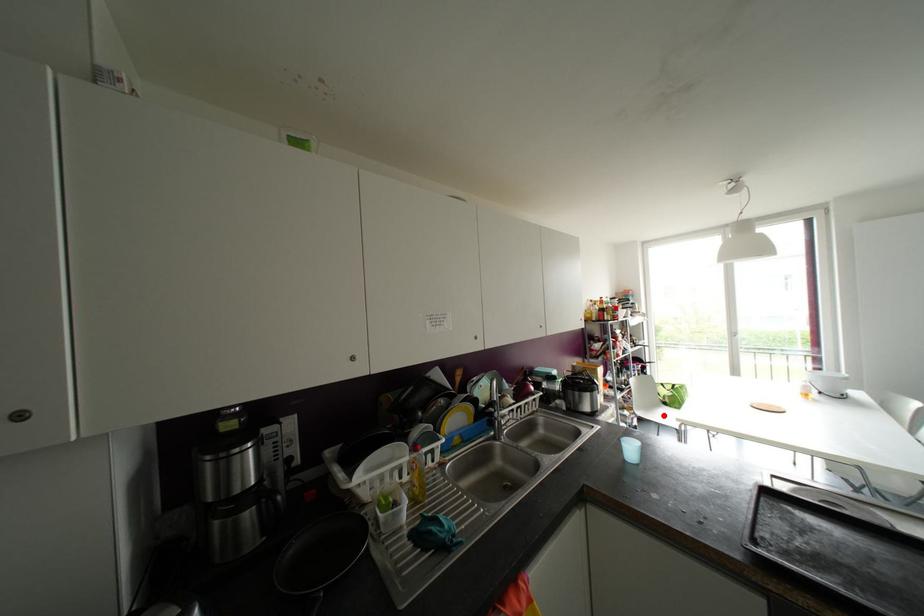
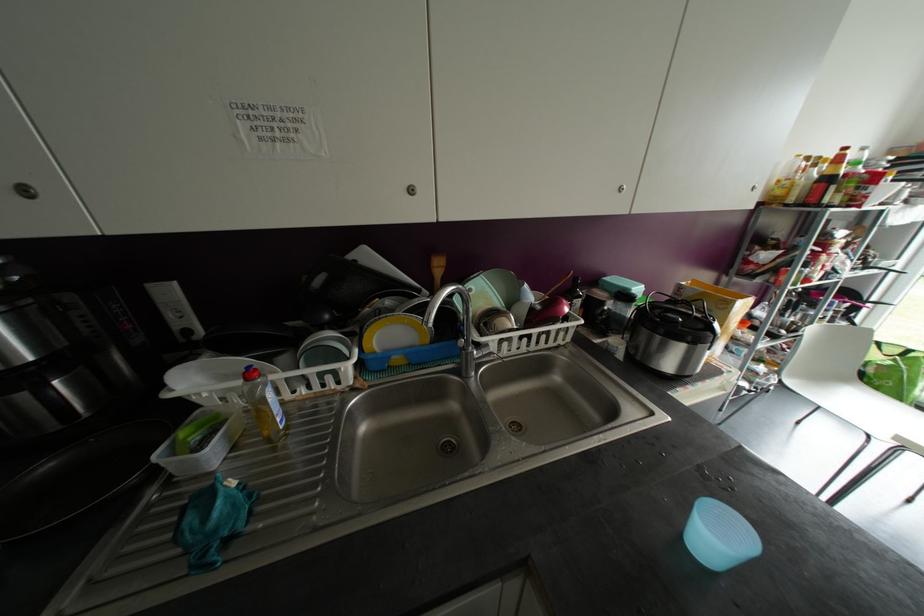
In the second image, find the point that corresponds to the highlighted location in the first image.

(852, 403)